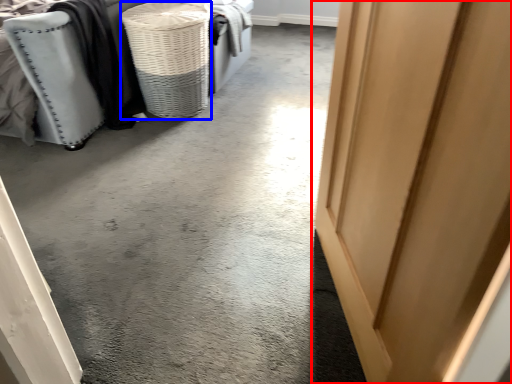
Question: Which object is closer to the camera taking this photo, door (highlighted by a red box) or basket (highlighted by a blue box)?

Choices:
 (A) door
 (B) basket

Answer: (A)